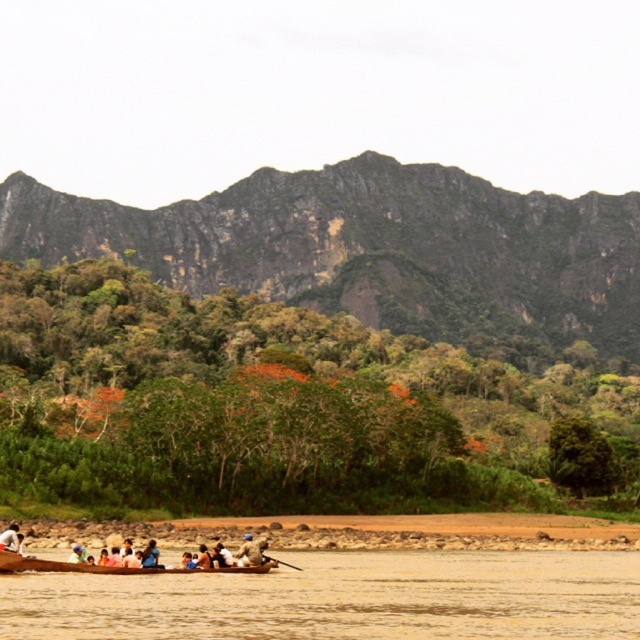
Can you confirm if brown muddy water at lower center is wider than brown leather boat at lower center?

Correct, the width of brown muddy water at lower center exceeds that of brown leather boat at lower center.

Which is behind, point (106, 600) or point (260, 547)?

The point (260, 547) is more distant.

Describe the element at coordinates (342, 600) in the screenshot. I see `brown muddy water at lower center` at that location.

Find the location of a particular element. brown muddy water at lower center is located at coordinates (342, 600).

Does rugged rock mountain at upper center appear under brown leather boat at lower center?

Incorrect, rugged rock mountain at upper center is not positioned below brown leather boat at lower center.

Can you confirm if rugged rock mountain at upper center is bigger than brown leather boat at lower center?

Yes, rugged rock mountain at upper center is bigger than brown leather boat at lower center.

Image resolution: width=640 pixels, height=640 pixels. In order to click on rugged rock mountain at upper center in this screenshot , I will do `click(371, 246)`.

I want to click on brown muddy water at lower center, so click(x=342, y=600).

Is brown muddy water at lower center shorter than white fabric person at lower left?

Incorrect, brown muddy water at lower center's height does not fall short of white fabric person at lower left's.

Which is in front, point (104, 604) or point (1, 544)?

Point (104, 604) is more forward.

Where is `brown muddy water at lower center`? brown muddy water at lower center is located at coordinates (342, 600).